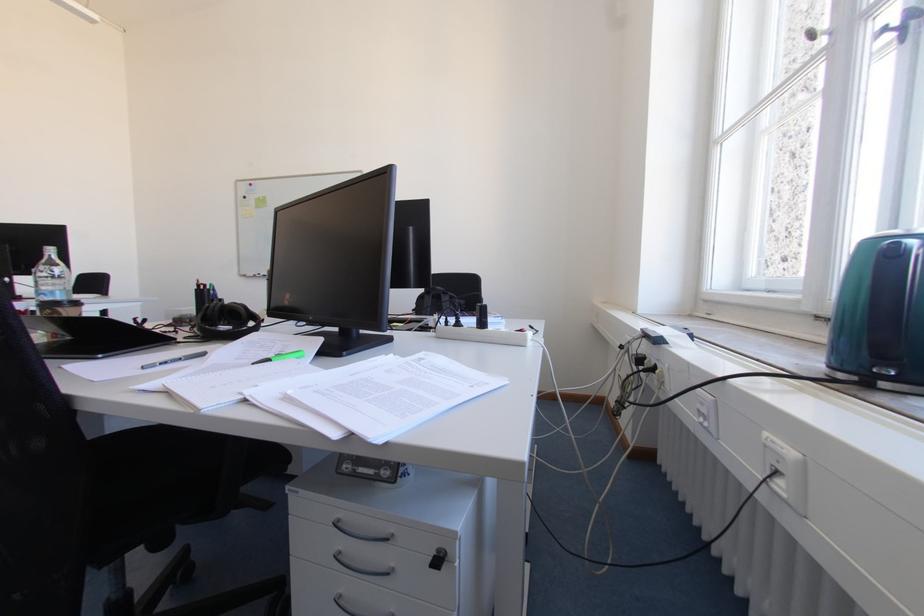
What do you see at coordinates (52, 282) in the screenshot? This screenshot has height=616, width=924. I see `the clear water bottle` at bounding box center [52, 282].